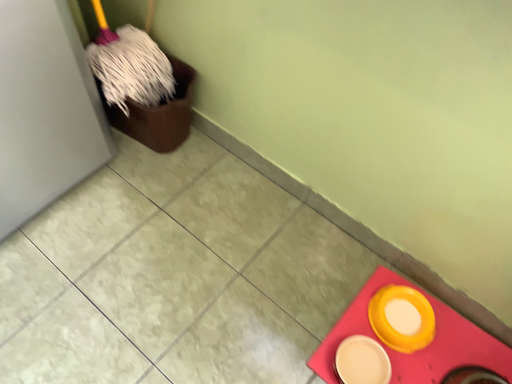
Locate an element on the screen. Image resolution: width=512 pixels, height=384 pixels. blank space situated above matte yellow bowl at lower right (from a real-world perspective) is located at coordinates (408, 347).